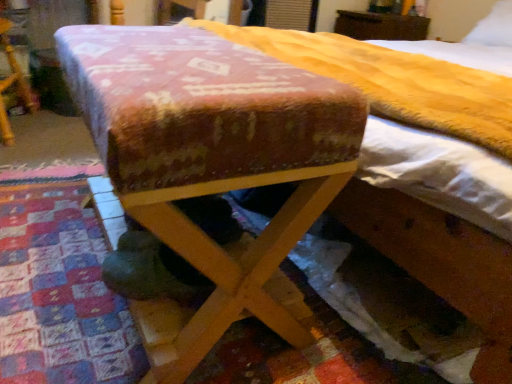
Question: From the image's perspective, does wooden bed at center appear lower than brown wooden dresser at upper center, the third furniture viewed from the front?

Choices:
 (A) yes
 (B) no

Answer: (A)

Question: Is wooden bed at center far from brown wooden dresser at upper center, the 1th furniture viewed from the right?

Choices:
 (A) yes
 (B) no

Answer: (A)

Question: From a real-world perspective, is wooden bed at center below brown wooden dresser at upper center, the 3th furniture from the bottom?

Choices:
 (A) yes
 (B) no

Answer: (A)

Question: Does wooden bed at center come behind brown wooden dresser at upper center, the 1th furniture viewed from the right?

Choices:
 (A) yes
 (B) no

Answer: (B)

Question: Is wooden bed at center at the left side of brown wooden dresser at upper center, the third furniture from the left?

Choices:
 (A) no
 (B) yes

Answer: (A)

Question: Considering the positions of brown wooden dresser at upper center, the third furniture viewed from the front, and wooden bed at center in the image, is brown wooden dresser at upper center, the third furniture viewed from the front, bigger or smaller than wooden bed at center?

Choices:
 (A) small
 (B) big

Answer: (A)

Question: In the image, is brown wooden dresser at upper center, placed as the 1th furniture when sorted from back to front, positioned in front of or behind wooden bed at center?

Choices:
 (A) behind
 (B) front

Answer: (A)

Question: From a real-world perspective, is brown wooden dresser at upper center, the third furniture viewed from the front, positioned above or below wooden bed at center?

Choices:
 (A) below
 (B) above

Answer: (B)

Question: From the image's perspective, relative to wooden bed at center, is brown wooden dresser at upper center, the first furniture positioned from the top, above or below?

Choices:
 (A) above
 (B) below

Answer: (A)

Question: From the image's perspective, relative to white soft pillow at upper right, is velvet-like fabric ottoman at center, the first furniture when ordered from front to back, above or below?

Choices:
 (A) below
 (B) above

Answer: (A)

Question: Is velvet-like fabric ottoman at center, the third furniture in the back-to-front sequence, bigger or smaller than white soft pillow at upper right?

Choices:
 (A) big
 (B) small

Answer: (A)

Question: Is velvet-like fabric ottoman at center, acting as the 3th furniture starting from the top, wider or thinner than white soft pillow at upper right?

Choices:
 (A) thin
 (B) wide

Answer: (B)

Question: Is velvet-like fabric ottoman at center, the first furniture when ordered from front to back, in front of or behind white soft pillow at upper right in the image?

Choices:
 (A) behind
 (B) front

Answer: (B)

Question: In the image, is textured wool mattress at center on the left side or the right side of white soft pillow at upper right?

Choices:
 (A) right
 (B) left

Answer: (B)

Question: Which is correct: textured wool mattress at center is inside white soft pillow at upper right, or outside of it?

Choices:
 (A) inside
 (B) outside

Answer: (B)